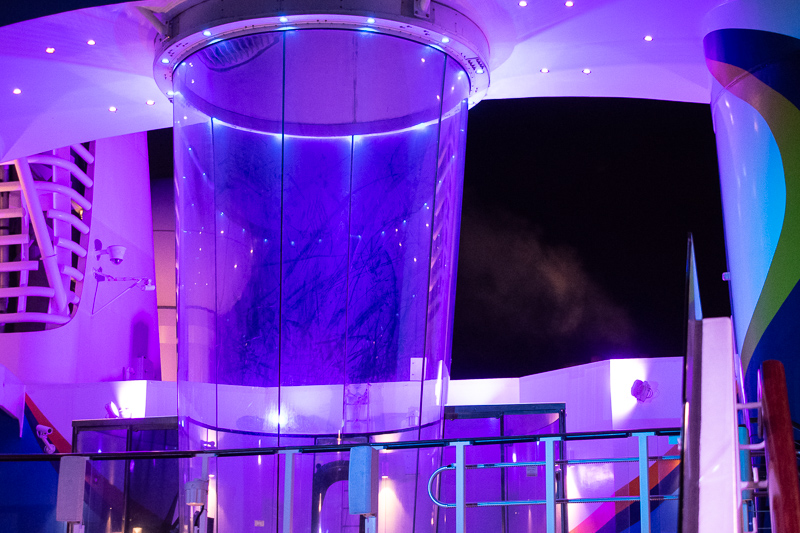
In order to click on can light in this screenshot , I will do `click(545, 70)`, `click(588, 72)`, `click(521, 3)`, `click(566, 6)`, `click(646, 39)`, `click(110, 106)`, `click(150, 100)`, `click(24, 94)`, `click(56, 49)`, `click(89, 50)`.